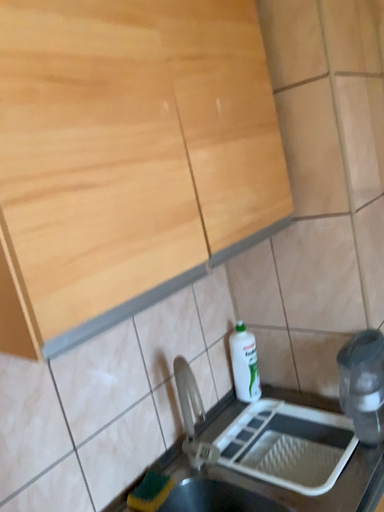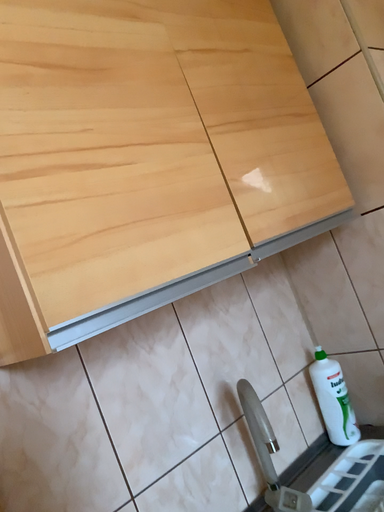
Question: Which way did the camera rotate in the video?

Choices:
 (A) rotated left
 (B) rotated right

Answer: (A)